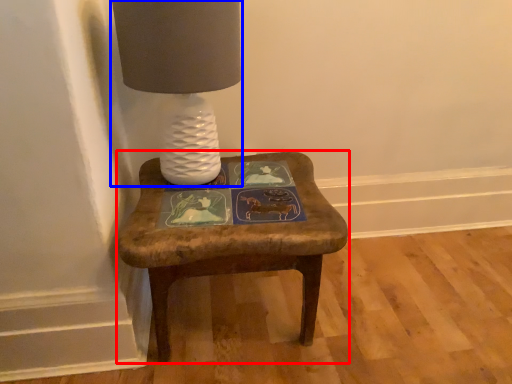
Question: Which of the following is the farthest to the observer, stool (highlighted by a red box) or table lamp (highlighted by a blue box)?

Choices:
 (A) stool
 (B) table lamp

Answer: (A)